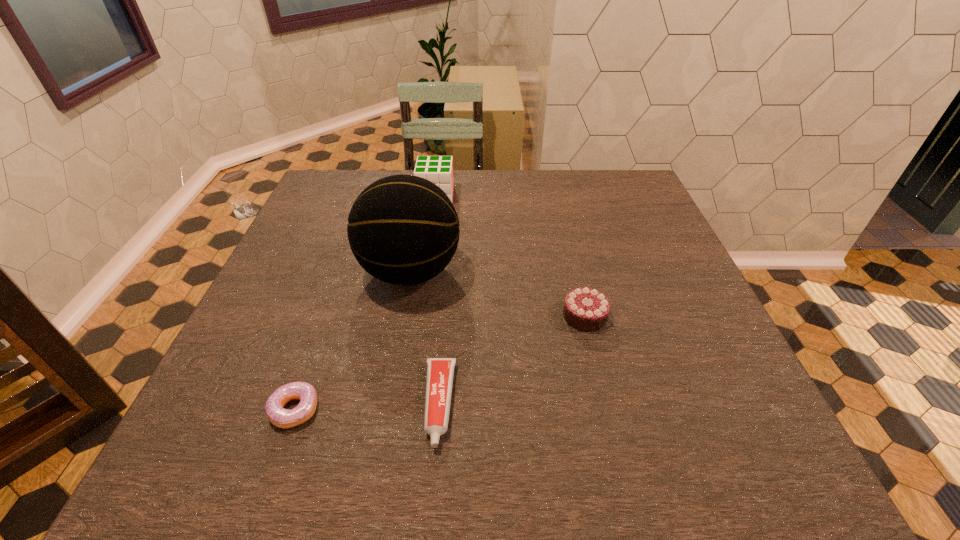
Point out which object is positioned as the third nearest to the tallest object. Please provide its 2D coordinates. Your answer should be formatted as a tuple, i.e. [(x, y)], where the tuple contains the x and y coordinates of a point satisfying the conditions above.

[(283, 418)]

This screenshot has width=960, height=540. Identify the location of free space that satisfies the following two spatial constraints: 1. on the red face of the cube; 2. on the right side of the chocolate cake. (420, 316).

This screenshot has height=540, width=960. Find the location of `vacant region that satisfies the following two spatial constraints: 1. on the red face of the fourth shortest object; 2. on the back side of the chocolate cake`. vacant region that satisfies the following two spatial constraints: 1. on the red face of the fourth shortest object; 2. on the back side of the chocolate cake is located at coordinates (420, 316).

Locate an element on the screen. The image size is (960, 540). free space that satisfies the following two spatial constraints: 1. on the front side of the basketball; 2. on the right side of the chocolate cake is located at coordinates (402, 316).

The width and height of the screenshot is (960, 540). Identify the location of free space that satisfies the following two spatial constraints: 1. on the back side of the doughnut; 2. on the left side of the basketball. (343, 272).